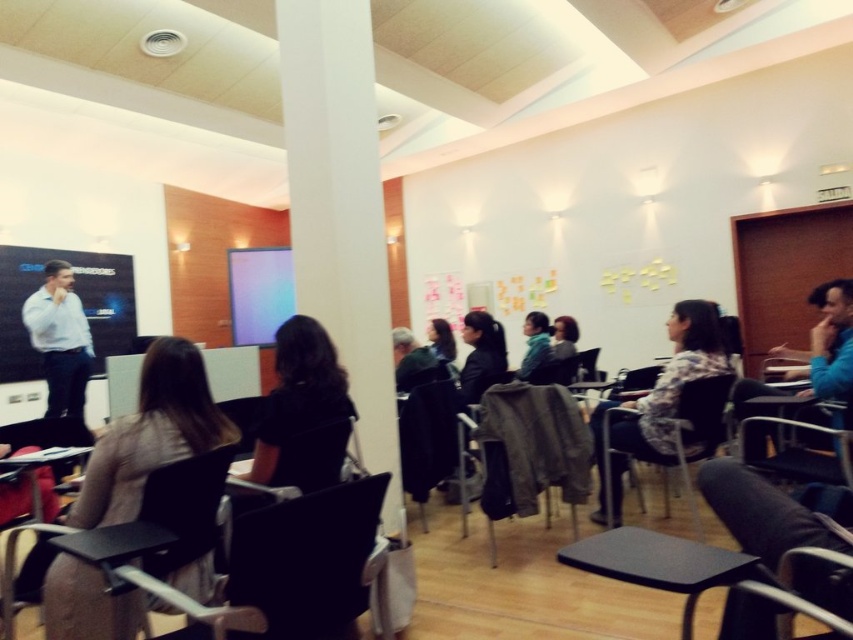
You are organizing a photo shoot and need to ensure that the blue fleece jacket at right and the black hair at center are visible in the frame. Given their sizes, which object should you focus on to ensure both are in the frame without cropping?

The blue fleece jacket at right is larger than the black hair at center, so focusing on the blue fleece jacket at right will ensure both objects are visible in the frame without cropping.

You are a student sitting at the black plastic table at lower center in the classroom. You want to see the matte blue screen at center clearly. Is the table blocking your view of the screen?

The black plastic table at lower center is shorter than the matte blue screen at center, so the table is not tall enough to block your view of the screen.

You are standing in the classroom and want to determine which of the two points, point (828, 316) or point (498, 369), is closer to you. Based on the scene description, which point is nearer?

Point (828, 316) is closer to the camera than point (498, 369), so it is nearer to you.